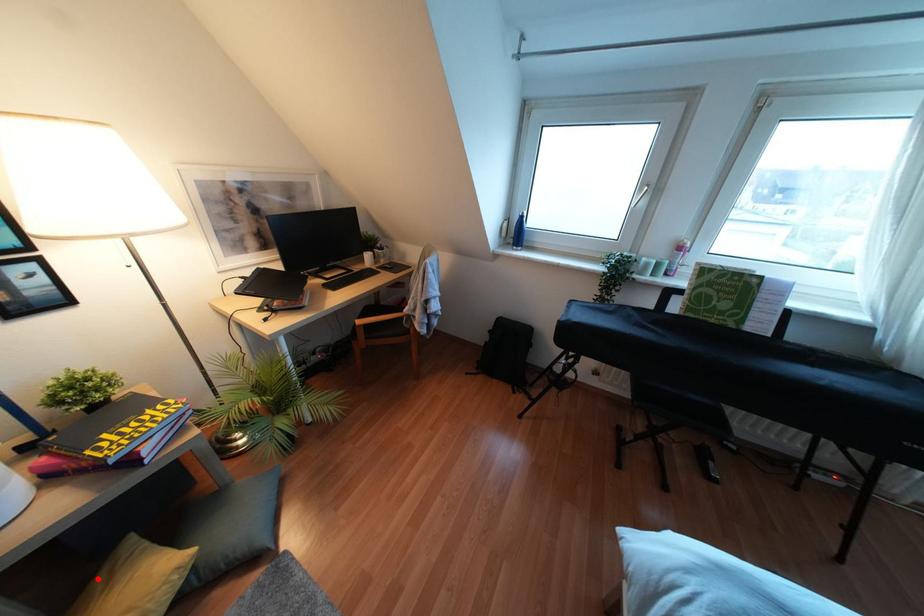
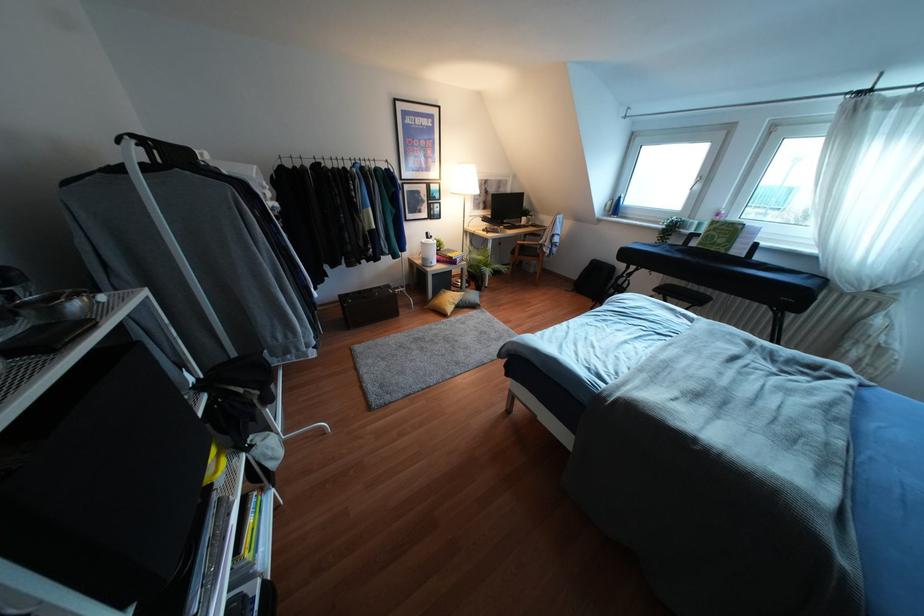
Question: I am providing you with two images of the same scene from different viewpoints. A red point is marked on the first image. Is the red point's position out of view in image 2?

Choices:
 (A) Yes
 (B) No

Answer: (B)